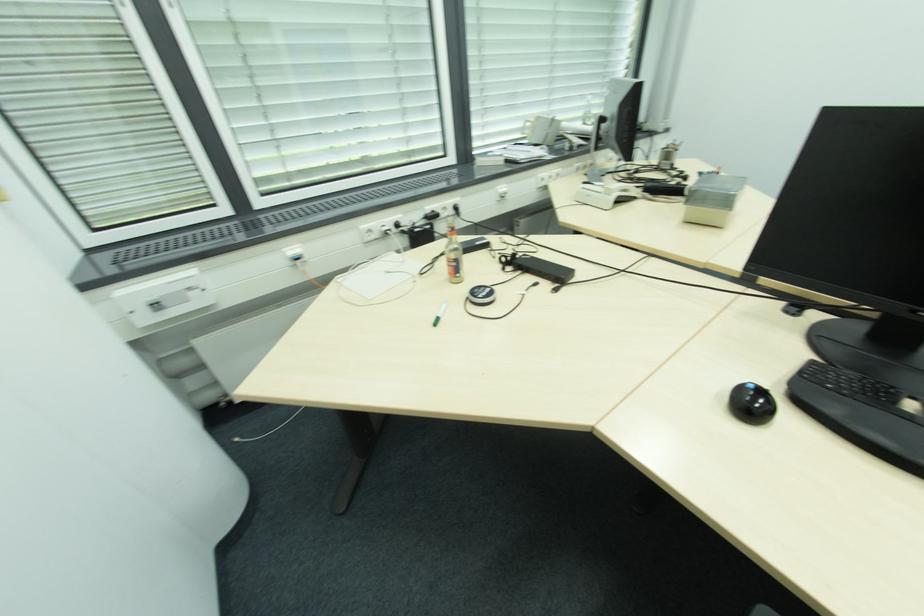
Find where to lift the white phone handset. Please return your answer as a coordinate pair (x, y).

(614, 185)